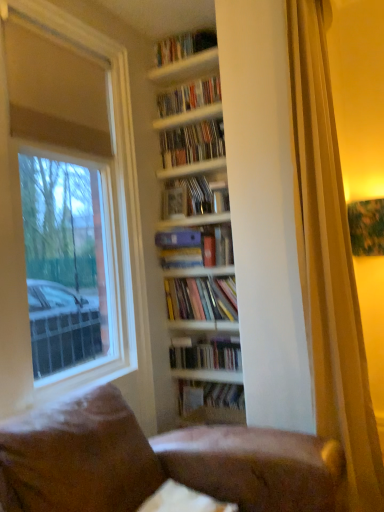
Question: In which direction should I rotate to look at hardcover books at upper center, which is the first book in top-to-bottom order?

Choices:
 (A) right
 (B) left

Answer: (B)

Question: Is wooden shelves at upper center, which is the 2th shelf in top-to-bottom order, taller than white matte window at left?

Choices:
 (A) no
 (B) yes

Answer: (A)

Question: Is wooden shelves at upper center, which is the 2th shelf in top-to-bottom order, facing away from white matte window at left?

Choices:
 (A) yes
 (B) no

Answer: (B)

Question: Is wooden shelves at upper center, the 1th shelf ordered from the bottom, behind white matte window at left?

Choices:
 (A) no
 (B) yes

Answer: (B)

Question: Is wooden shelves at upper center, which is the 2th shelf in top-to-bottom order, not within white matte window at left?

Choices:
 (A) yes
 (B) no

Answer: (A)

Question: Is the position of wooden shelves at upper center, the 1th shelf ordered from the bottom, less distant than that of white matte window at left?

Choices:
 (A) no
 (B) yes

Answer: (A)

Question: From a real-world perspective, is wooden shelves at upper center, the 1th shelf ordered from the bottom, located beneath white matte window at left?

Choices:
 (A) no
 (B) yes

Answer: (A)

Question: From a real-world perspective, is wooden shelves at upper center, the 1th shelf ordered from the bottom, on hardcover book at center, which is the 1th book in bottom-to-top order?

Choices:
 (A) yes
 (B) no

Answer: (A)

Question: Is the surface of wooden shelves at upper center, the 1th shelf ordered from the bottom, in direct contact with hardcover book at center, arranged as the 8th book when viewed from the top?

Choices:
 (A) no
 (B) yes

Answer: (A)

Question: Is hardcover book at center, arranged as the 8th book when viewed from the top, a part of wooden shelves at upper center, the 1th shelf ordered from the bottom?

Choices:
 (A) yes
 (B) no

Answer: (B)

Question: Considering the relative sizes of wooden shelves at upper center, the 1th shelf ordered from the bottom, and hardcover book at center, arranged as the 8th book when viewed from the top, in the image provided, is wooden shelves at upper center, the 1th shelf ordered from the bottom, bigger than hardcover book at center, arranged as the 8th book when viewed from the top,?

Choices:
 (A) no
 (B) yes

Answer: (A)

Question: Can you confirm if wooden shelves at upper center, the 1th shelf ordered from the bottom, is thinner than hardcover book at center, which is the 1th book in bottom-to-top order?

Choices:
 (A) no
 (B) yes

Answer: (A)

Question: Can you confirm if wooden shelves at upper center, which is the 2th shelf in top-to-bottom order, is positioned to the left of hardcover book at center, which is the 1th book in bottom-to-top order?

Choices:
 (A) yes
 (B) no

Answer: (A)

Question: Considering the relative sizes of white glossy shelves at upper center, the 1th shelf from the top, and hardcover books at center, placed as the seventh book when sorted from top to bottom, in the image provided, is white glossy shelves at upper center, the 1th shelf from the top, smaller than hardcover books at center, placed as the seventh book when sorted from top to bottom,?

Choices:
 (A) yes
 (B) no

Answer: (A)